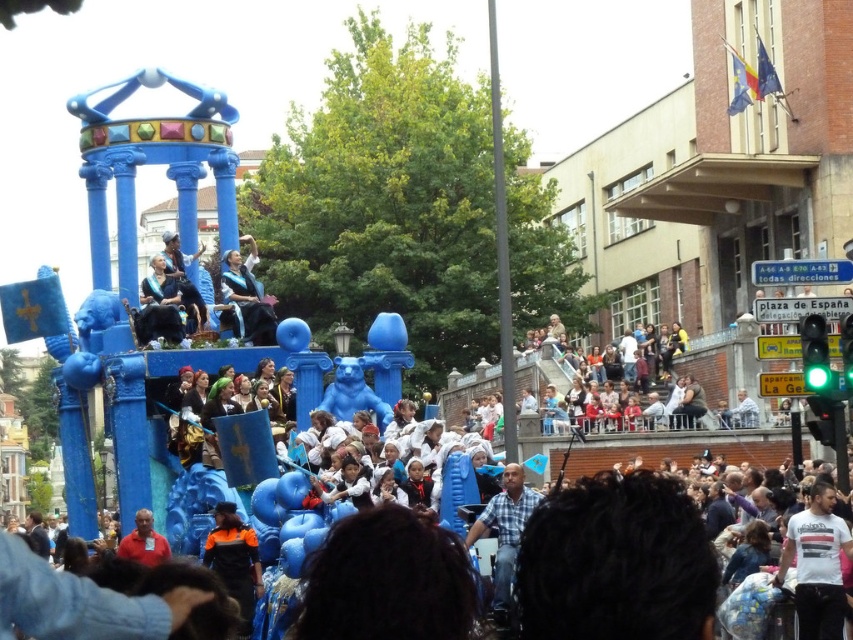
You are a photographer trying to capture a photo of the plaid shirt at center and the matte black outfit at center. The camera you have can only focus on objects within a 1.5 meter width. Can you fit both subjects into the frame without moving the camera?

The plaid shirt at center is wider than the matte black outfit at center. Since the camera can only focus on objects within a 1.5 meter width, you need to check if the combined width of both subjects exceeds this limit. However, the exact widths aren not provided in the description. Therefore, it is uncertain if they can both fit without moving the camera.

You are a photographer trying to capture the float in the center of the image. There is a person wearing a plaid shirt at center blocking your view. Can you move to the left or right to avoid them and still see the float?

The plaid shirt at center is located at point (505, 531), so moving either left or right should allow you to avoid the obstruction while still maintaining a clear view of the float.

You are a photographer standing at the edge of the crowd trying to capture both the plaid shirt at center and the matte black outfit at center in a single shot. Your camera has a maximum zoom range that can cover 25 meters. Can you fit both subjects into the frame without moving closer?

The plaid shirt at center and matte black outfit at center are 25.25 meters apart from each other. Since the camera can only cover 25 meters, the distance between them exceeds the maximum zoom range by 0.25 meters. Therefore, you cannot fit both subjects into the frame without moving closer.